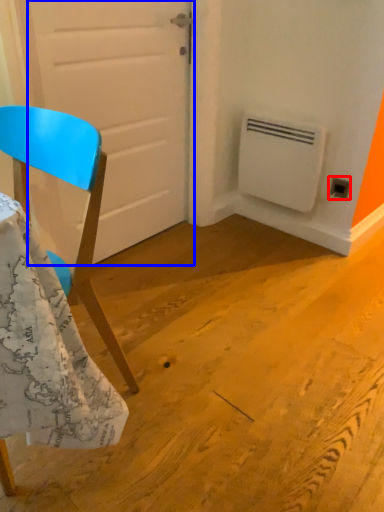
Question: Which object is closer to the camera taking this photo, electric outlet (highlighted by a red box) or door (highlighted by a blue box)?

Choices:
 (A) electric outlet
 (B) door

Answer: (B)